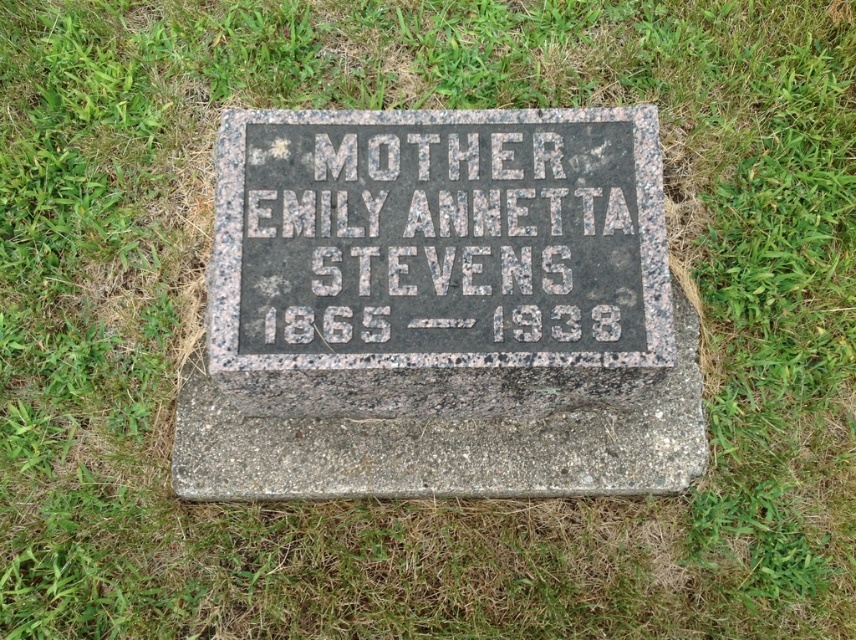
Question: Among these objects, which one is farthest from the camera?

Choices:
 (A) granite at center
 (B) granite gravestone at center

Answer: (A)

Question: In this image, where is granite gravestone at center located relative to granite at center?

Choices:
 (A) below
 (B) above

Answer: (A)

Question: Which point is closer to the camera?

Choices:
 (A) (577, 128)
 (B) (379, 266)

Answer: (B)

Question: Considering the relative positions of granite gravestone at center and granite at center in the image provided, where is granite gravestone at center located with respect to granite at center?

Choices:
 (A) left
 (B) right

Answer: (B)

Question: Which of the following is the closest to the observer?

Choices:
 (A) (366, 396)
 (B) (432, 125)

Answer: (B)

Question: Considering the relative positions of granite gravestone at center and granite at center in the image provided, where is granite gravestone at center located with respect to granite at center?

Choices:
 (A) above
 (B) below

Answer: (B)